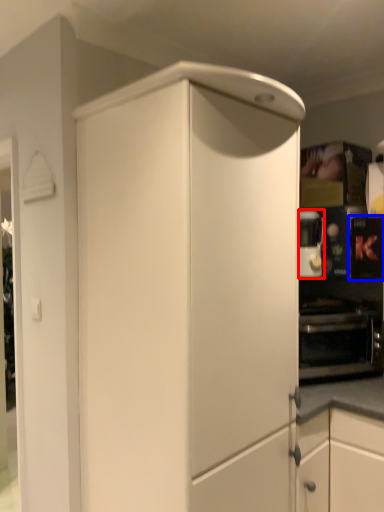
Question: Which object appears closest to the camera in this image, coffee machine (highlighted by a red box) or appliance (highlighted by a blue box)?

Choices:
 (A) coffee machine
 (B) appliance

Answer: (B)